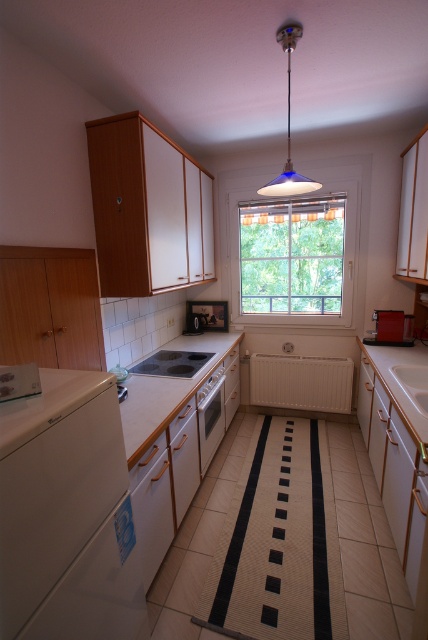
Question: Is black glass stove at center above white glossy sink at center?

Choices:
 (A) yes
 (B) no

Answer: (A)

Question: Does black glass stove at center have a smaller size compared to matte black oven at center?

Choices:
 (A) yes
 (B) no

Answer: (B)

Question: Among these points, which one is farthest from the camera?

Choices:
 (A) (65, 426)
 (B) (133, 444)

Answer: (B)

Question: Is matte silver oven at center positioned behind metallic red toaster at center-right?

Choices:
 (A) no
 (B) yes

Answer: (A)

Question: Among these objects, which one is nearest to the camera?

Choices:
 (A) clear glass window at center
 (B) matte silver oven at center
 (C) white matte dishwasher at lower left

Answer: (C)

Question: Which of the following is the farthest from the observer?

Choices:
 (A) white glossy sink at center
 (B) white laminate countertop at center

Answer: (A)